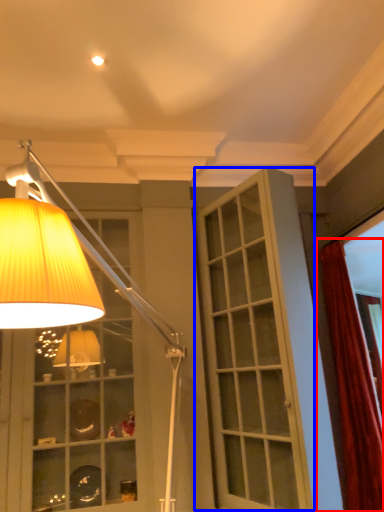
Question: Which object appears farthest to the camera in this image, curtain (highlighted by a red box) or screen door (highlighted by a blue box)?

Choices:
 (A) curtain
 (B) screen door

Answer: (A)